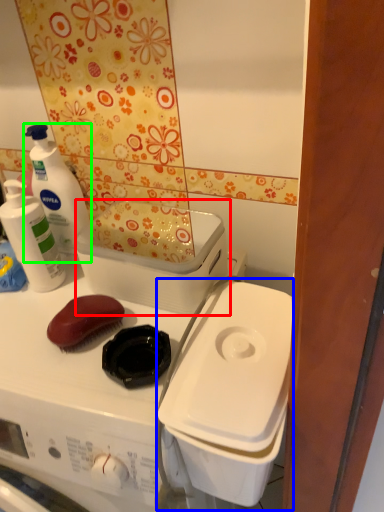
Question: Which object is the farthest from appliance (highlighted by a red box)? Choose among these: appliance (highlighted by a blue box) or cleaning product (highlighted by a green box).

Choices:
 (A) appliance
 (B) cleaning product

Answer: (B)